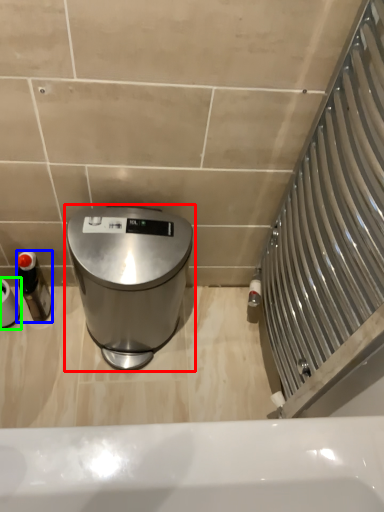
Question: Considering the real-world distances, which object is farthest from waste container (highlighted by a red box)? bottle (highlighted by a blue box) or toilet paper (highlighted by a green box)?

Choices:
 (A) bottle
 (B) toilet paper

Answer: (B)